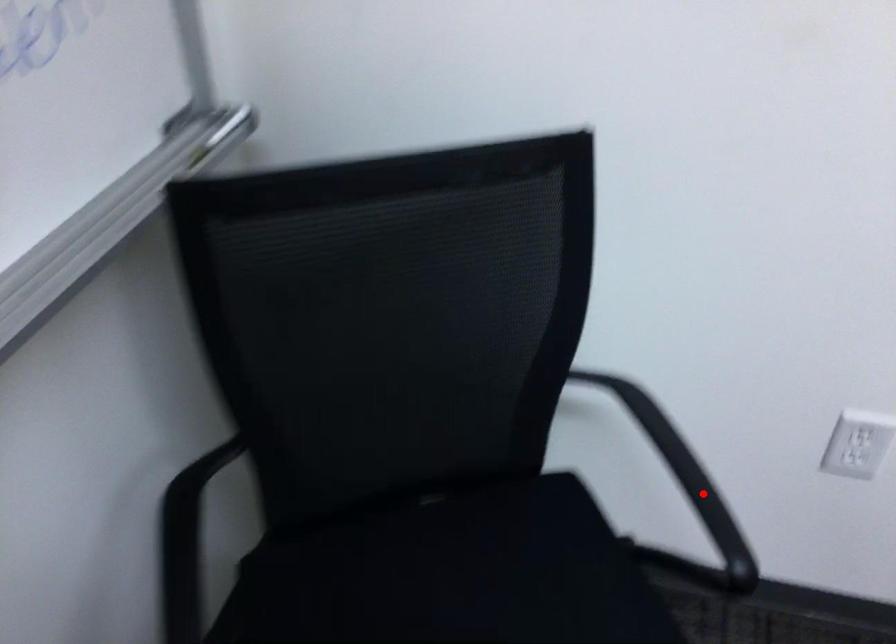
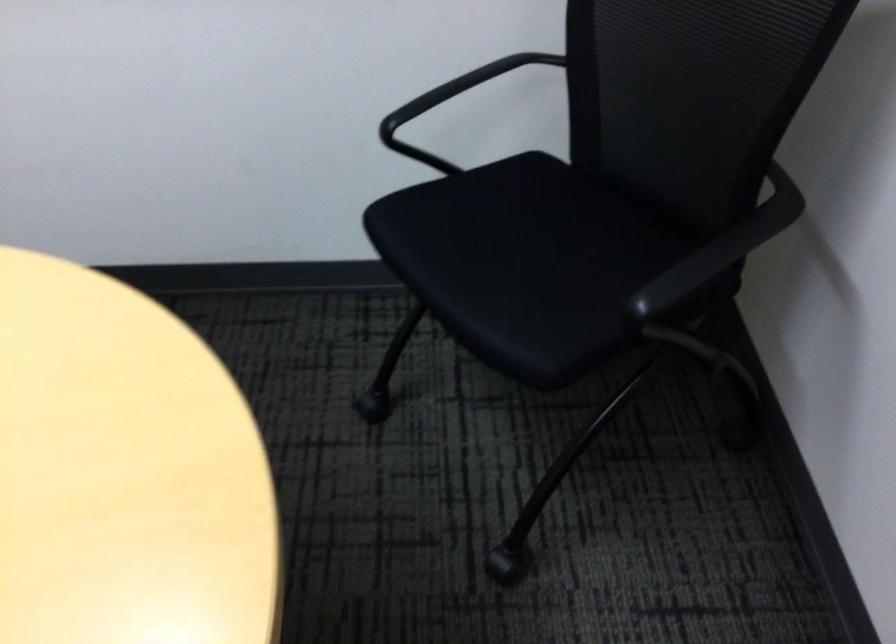
Find the pixel in the second image that matches the highlighted location in the first image.

(702, 268)